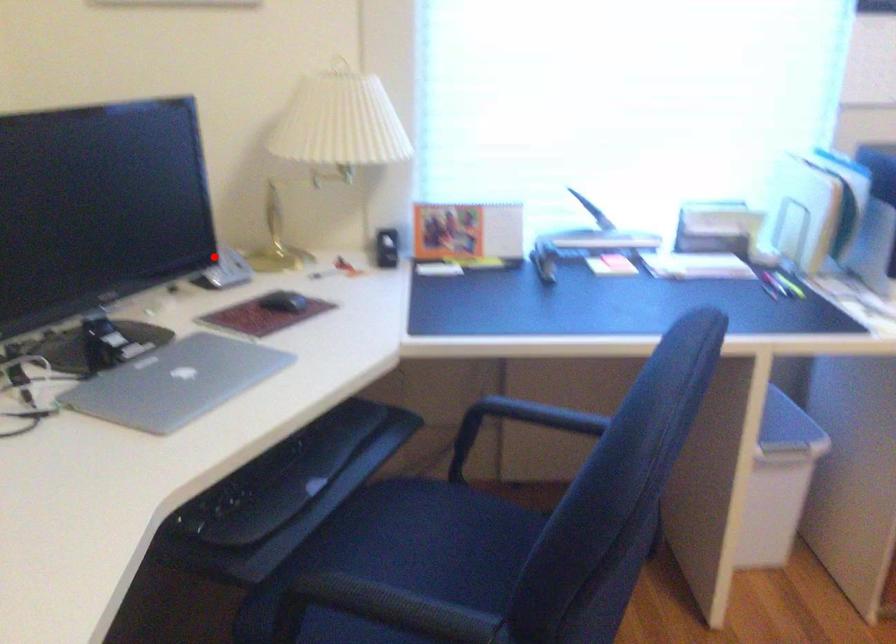
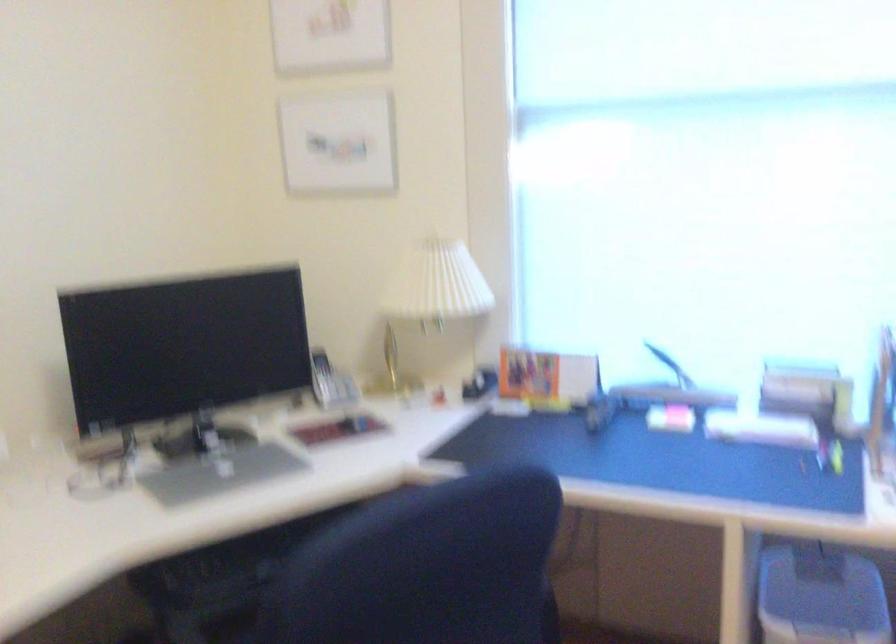
Question: I am providing you with two images of the same scene from different viewpoints. Image1 has a red point marked. In image2, the corresponding 3D location appears at what relative position? Reply with the corresponding letter.

Choices:
 (A) Closer
 (B) Farther

Answer: (B)